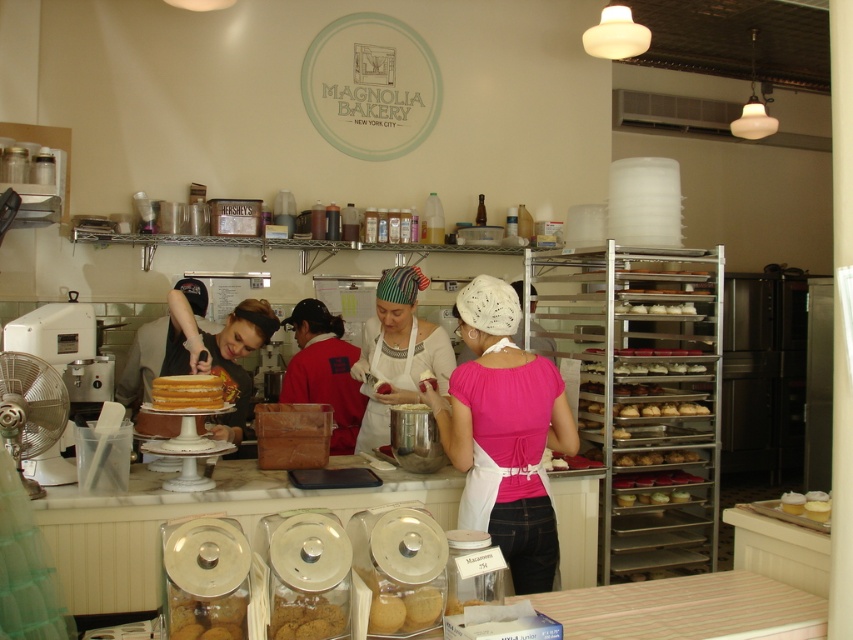
You are standing in the bakery and want to take a photo of the striped fabric headscarf at center. If your camera is 9.65 feet away from the scarf, is it within the recommended 10 feet distance for clear photos?

The striped fabric headscarf at center and camera are 9.65 feet apart, so yes, it is within the recommended 10 feet distance for clear photos.

You are a customer at Magnolia Bakery and you want to know which item is taller between the red fabric apron at center and the yellow sponge cake at center. Can you tell me which one is taller?

The red fabric apron at center is much taller than the yellow sponge cake at center according to the description.